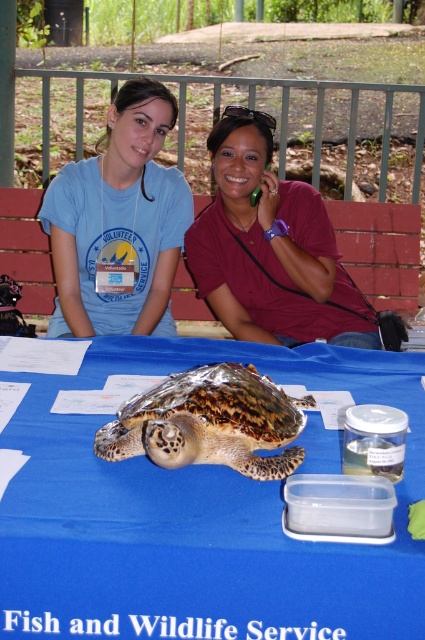
You are a wildlife researcher who needs to measure the turtle. You have a measuring tape that can extend up to 1 meter. Can you reach from the matte maroon shirt at center to the leathery brown turtle at center with your tape?

The distance between the matte maroon shirt at center and the leathery brown turtle at center is 1.01 meters, which is slightly longer than the 1 meter measuring tape can extend. Therefore, the tape is not long enough to reach from the matte maroon shirt at center to the leathery brown turtle at center.

You are at an outdoor event and need to place a sign on the table. The sign must be positioned to the right of the blue fabric table at center. Where should you place it in relation to the metallic green phone at upper center?

The blue fabric table at center is to the left of the metallic green phone at upper center, so placing the sign to the right of the blue fabric table at center would mean positioning it to the right of the metallic green phone at upper center.

Looking at this image, you are a photographer standing in front of the table where the matte maroon shirt at center and the leathery brown turtle at center are located. You want to take a photo of the turtle without the shirt blocking the view. Is the turtle visible behind the shirt?

The matte maroon shirt at center is further to the viewer than leathery brown turtle at center, so the turtle is behind the shirt and might be partially or fully obscured. Adjust your position to ensure the turtle is visible without obstruction.